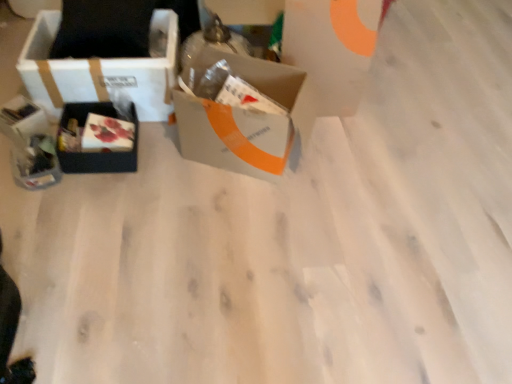
Find the location of a particular element. The height and width of the screenshot is (384, 512). free space in front of gray cardboard box at center, which is counted as the 3th box, starting from the left is located at coordinates (236, 224).